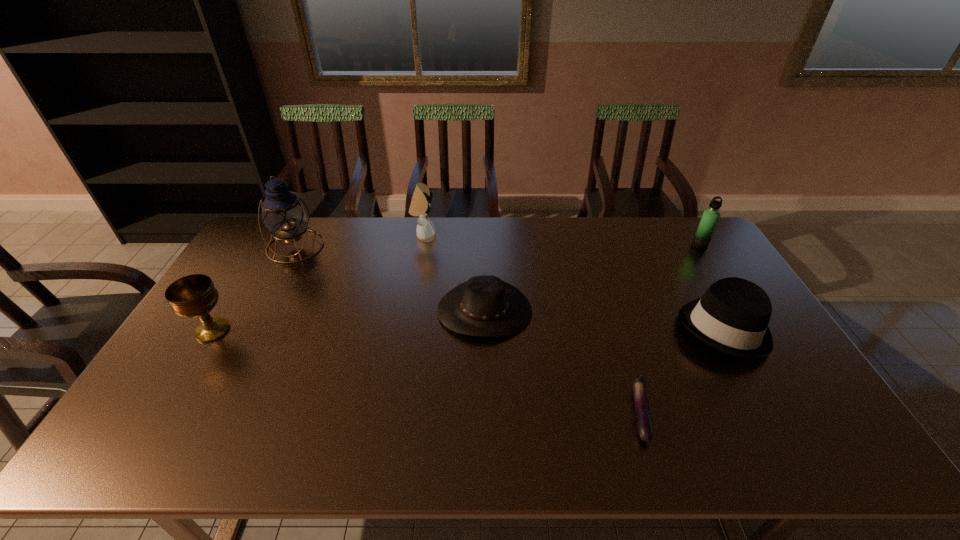
Find the location of a particular element. The width and height of the screenshot is (960, 540). vacant space located at the front face of the third object from left to right is located at coordinates (521, 235).

Locate an element on the screen. vacant area located 0.250m on the left of the thermos bottle is located at coordinates (623, 245).

At what (x,y) coordinates should I click in order to perform the action: click on vacant position located on the right of the chalice. Please return your answer as a coordinate pair (x, y). The height and width of the screenshot is (540, 960). Looking at the image, I should click on (274, 330).

I want to click on free space located on the front of the fedora, so click(x=789, y=446).

This screenshot has height=540, width=960. What are the coordinates of `vacant area situated 0.310m on the front-facing side of the second shortest object` in the screenshot? It's located at (486, 444).

Find the location of a particular element. Image resolution: width=960 pixels, height=540 pixels. vacant area situated on the right of the shortest object is located at coordinates (699, 413).

This screenshot has width=960, height=540. Identify the location of lantern positioned at the far edge. (284, 214).

You are a GUI agent. You are given a task and a screenshot of the screen. Output one action in this format:
    pyautogui.click(x=<x>, y=<y>)
    Task: Click on the doll that is at the far edge
    The width and height of the screenshot is (960, 540).
    Given the screenshot: What is the action you would take?
    pyautogui.click(x=420, y=205)

This screenshot has width=960, height=540. Find the location of `thermos bottle that is at the far edge`. thermos bottle that is at the far edge is located at coordinates (710, 217).

I want to click on object at the near edge, so click(643, 418).